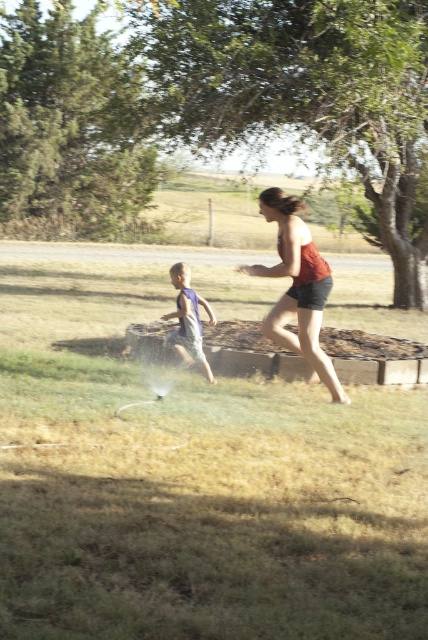
You are a drone operator trying to capture a photo of the blue cotton shorts at left and the green grass at center from above. What is the minimum distance you should set your camera to ensure both objects are in focus?

The minimum distance should be set to 2.00 meters to ensure both the green grass at center and the blue cotton shorts at left are in focus since they are 2.00 meters apart.

You are a photographer trying to capture a candid shot of the blue cotton shorts at left and the green grass at center. Based on their positions, which object should you focus on first to ensure both are in the frame?

The blue cotton shorts at left should be focused on first since the green grass at center is in front of it, ensuring both will be captured in the frame.

Based on the scene description, which object occupies more space in the image between the green grass at center and the matte red tank top at center?

The green grass at center has a larger size compared to the matte red tank top at center, so it occupies more space in the image.